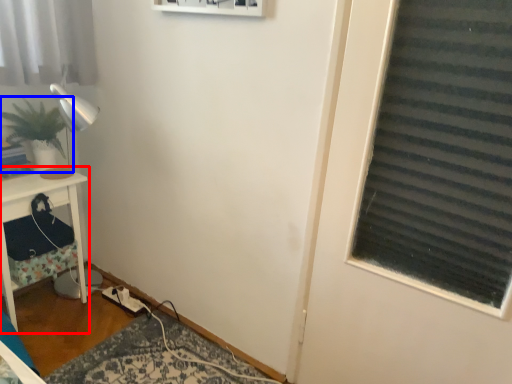
Question: Which object is closer to the camera taking this photo, furniture (highlighted by a red box) or houseplant (highlighted by a blue box)?

Choices:
 (A) furniture
 (B) houseplant

Answer: (A)